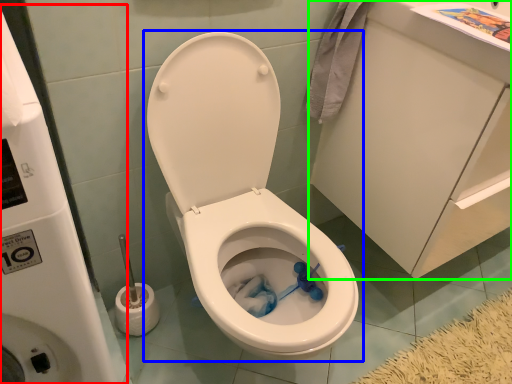
Question: Which object is positioned farthest from water tank (highlighted by a red box)? Select from toilet (highlighted by a blue box) and porcelain (highlighted by a green box).

Choices:
 (A) toilet
 (B) porcelain

Answer: (B)